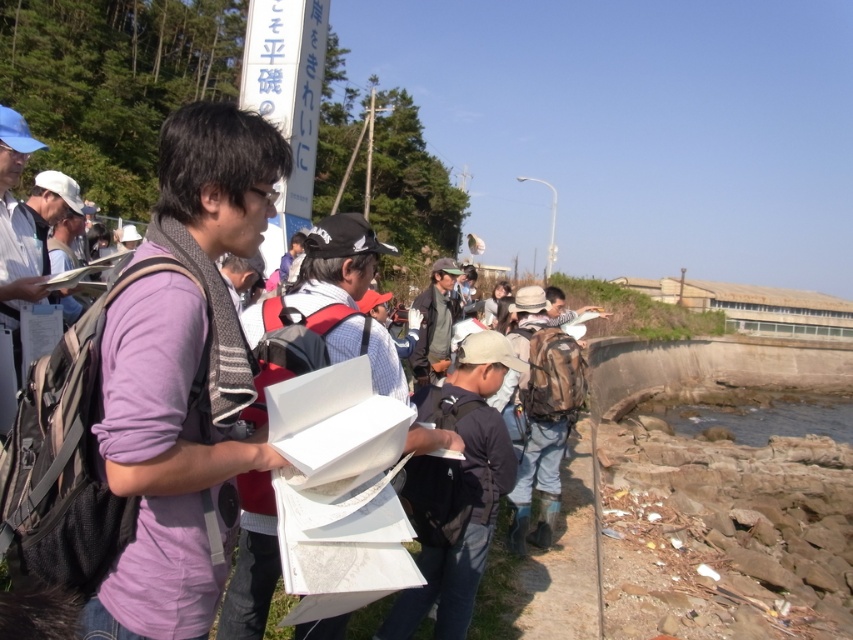
Between point (141, 310) and point (747, 400), which one is positioned in front?

Point (141, 310) is more forward.

At what (x,y) coordinates should I click in order to perform the action: click on purple matte shirt at center. Please return your answer as a coordinate pair (x, y). This screenshot has height=640, width=853. Looking at the image, I should click on (183, 376).

Can you confirm if clear water at lower right is wider than dark green jacket at center?

Yes, clear water at lower right is wider than dark green jacket at center.

Who is more distant from viewer, (780, 406) or (418, 368)?

Positioned behind is point (780, 406).

Is point (669, 406) less distant than point (440, 337)?

That is False.

Where is `clear water at lower right`? This screenshot has height=640, width=853. clear water at lower right is located at coordinates (751, 412).

Is purple matte shirt at center above dark green jacket at center?

No, purple matte shirt at center is not above dark green jacket at center.

Does purple matte shirt at center appear on the left side of dark green jacket at center?

Correct, you'll find purple matte shirt at center to the left of dark green jacket at center.

Is point (235, 349) farther from viewer compared to point (437, 378)?

No, it is not.

Locate an element on the screen. purple matte shirt at center is located at coordinates (183, 376).